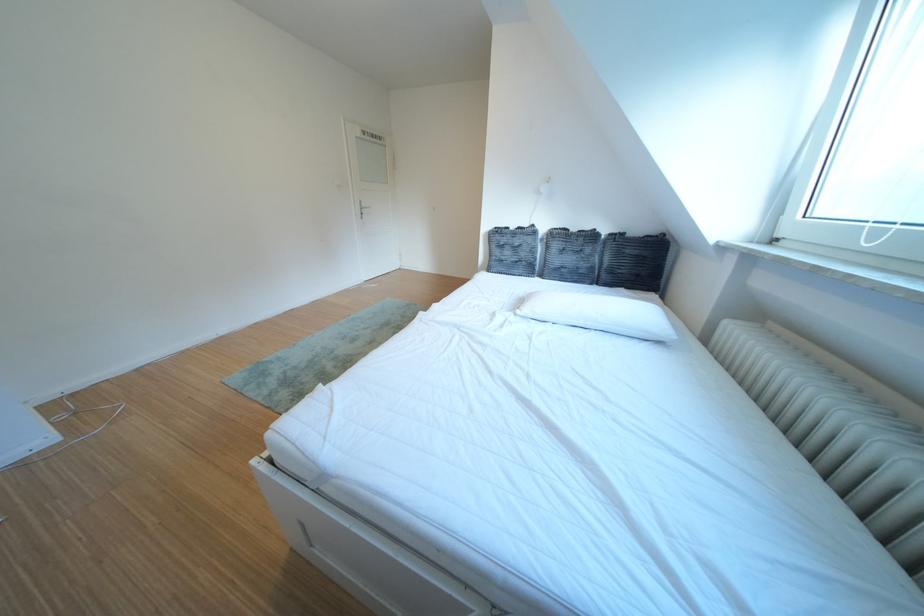
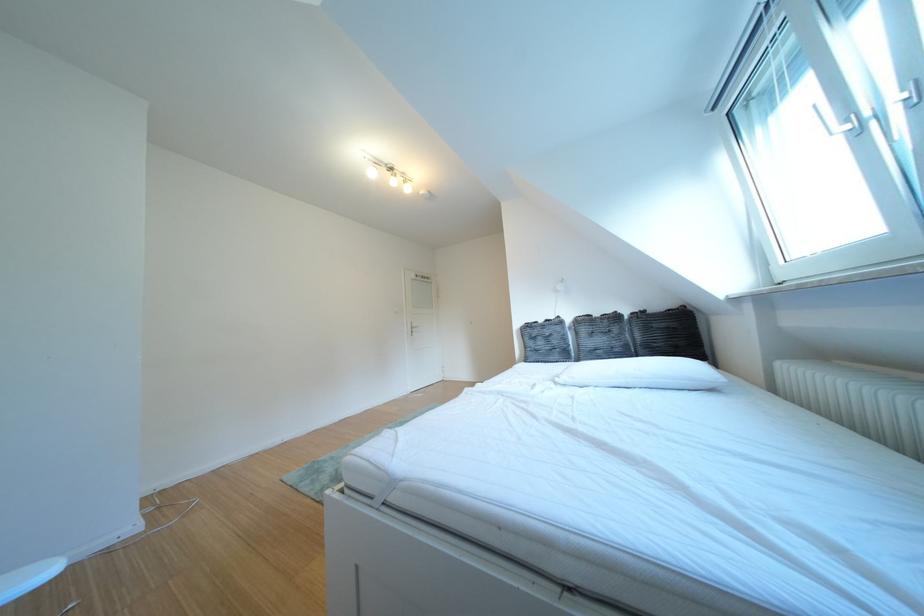
Question: The images are taken continuously from a first-person perspective. In which direction are you moving?

Choices:
 (A) Left
 (B) Right
 (C) Forward
 (D) Backward

Answer: (D)